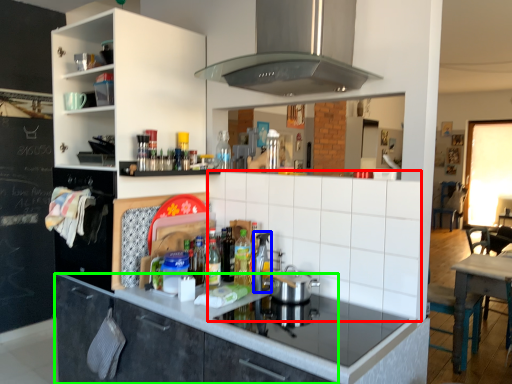
Question: Which object is the closest to the tile (highlighted by a red box)? Choose among these: appliance (highlighted by a blue box) or cabinetry (highlighted by a green box).

Choices:
 (A) appliance
 (B) cabinetry

Answer: (A)